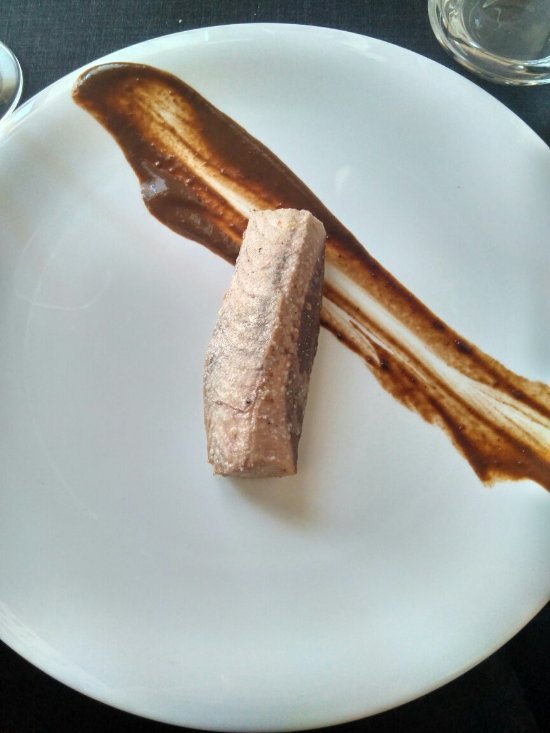
The image size is (550, 733). I want to click on surface, so click(517, 704).